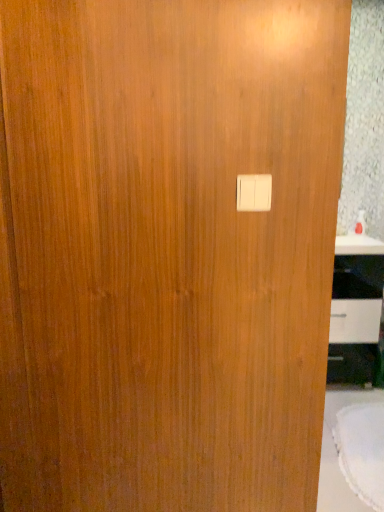
Question: From a real-world perspective, is white glossy cabinet at right positioned above or below white fabric table at lower right?

Choices:
 (A) below
 (B) above

Answer: (B)

Question: Is white glossy cabinet at right taller or shorter than white fabric table at lower right?

Choices:
 (A) tall
 (B) short

Answer: (A)

Question: Estimate the real-world distances between objects in this image. Which object is closer to the white fabric table at lower right?

Choices:
 (A) white glossy cabinet at right
 (B) white plastic light switch at center

Answer: (A)

Question: Estimate the real-world distances between objects in this image. Which object is farther from the white fabric table at lower right?

Choices:
 (A) white plastic light switch at center
 (B) white glossy cabinet at right

Answer: (A)